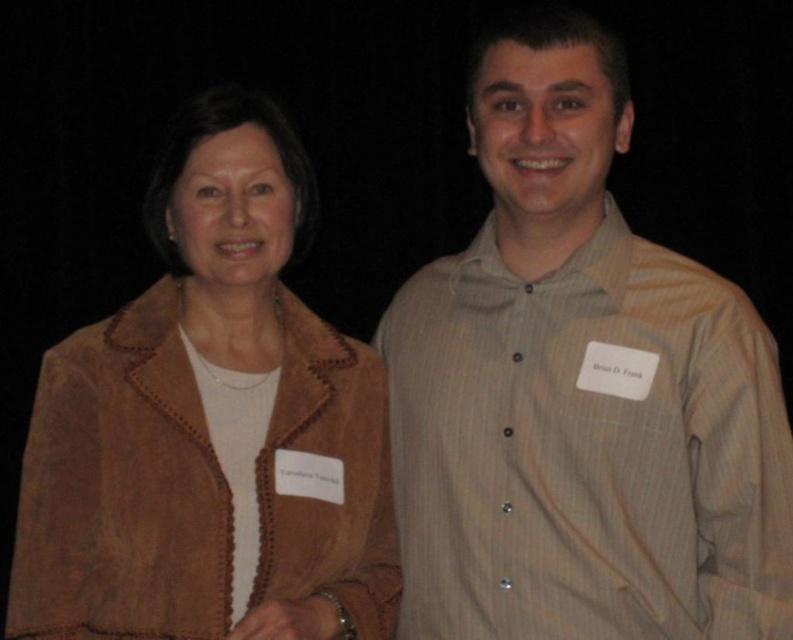
Who is positioned more to the left, light brown striped shirt at center or suede jacket at left?

suede jacket at left is more to the left.

Between light brown striped shirt at center and suede jacket at left, which one is positioned higher?

light brown striped shirt at center

In order to click on light brown striped shirt at center in this screenshot , I will do `click(579, 392)`.